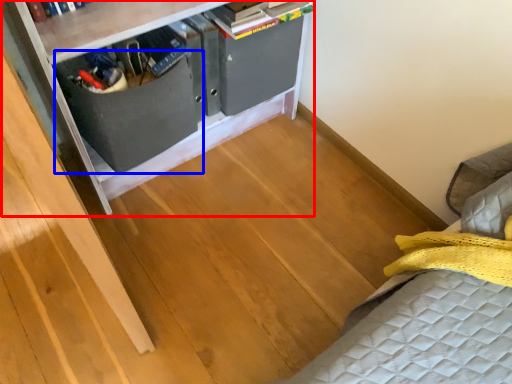
Question: Which object appears closest to the camera in this image, furniture (highlighted by a red box) or drawer (highlighted by a blue box)?

Choices:
 (A) furniture
 (B) drawer

Answer: (A)